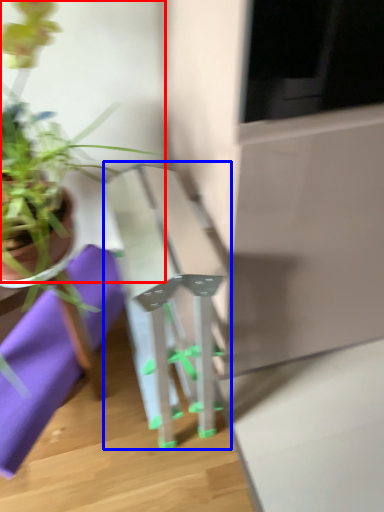
Question: Which of the following is the closest to the observer, houseplant (highlighted by a red box) or table (highlighted by a blue box)?

Choices:
 (A) houseplant
 (B) table

Answer: (A)